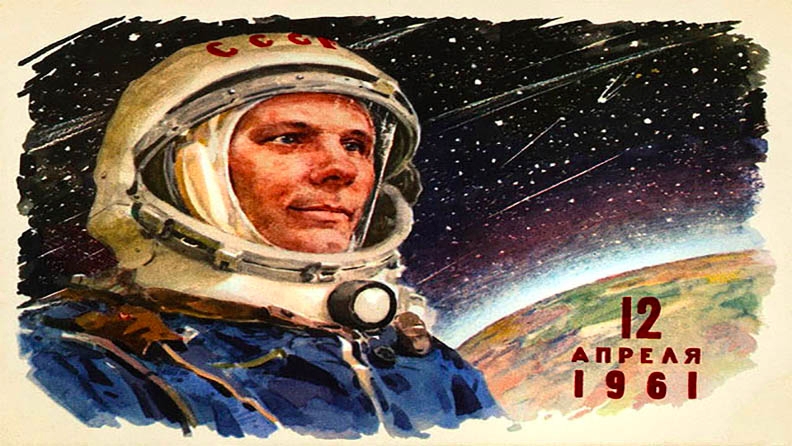
Locate an element on the screen. This screenshot has height=446, width=792. painting is located at coordinates (522, 164).